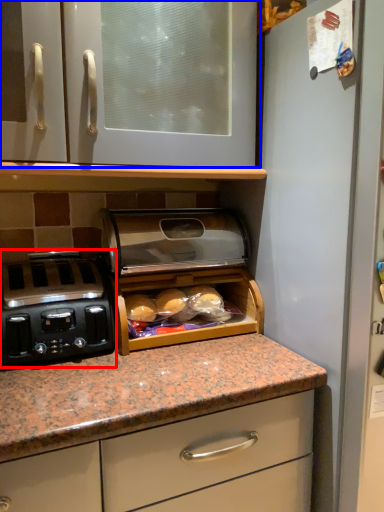
Question: Which of the following is the farthest to the observer, home appliance (highlighted by a red box) or cabinetry (highlighted by a blue box)?

Choices:
 (A) home appliance
 (B) cabinetry

Answer: (A)